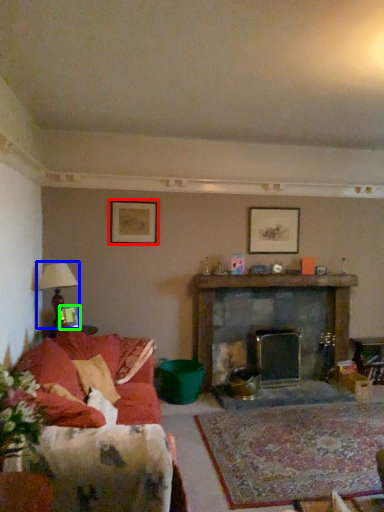
Question: Which is nearer to the picture frame (highlighted by a red box)? lamp (highlighted by a blue box) or picture frame (highlighted by a green box).

Choices:
 (A) lamp
 (B) picture frame

Answer: (A)